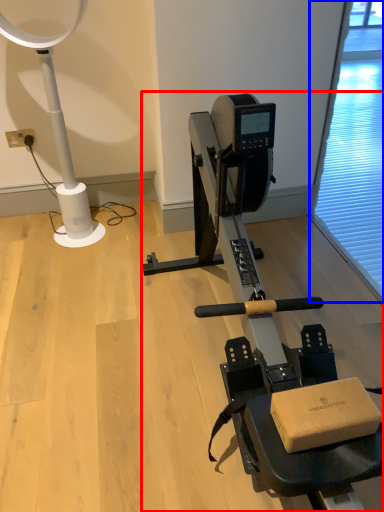
Question: Which object is closer to the camera taking this photo, stationary bicycle (highlighted by a red box) or screen door (highlighted by a blue box)?

Choices:
 (A) stationary bicycle
 (B) screen door

Answer: (A)